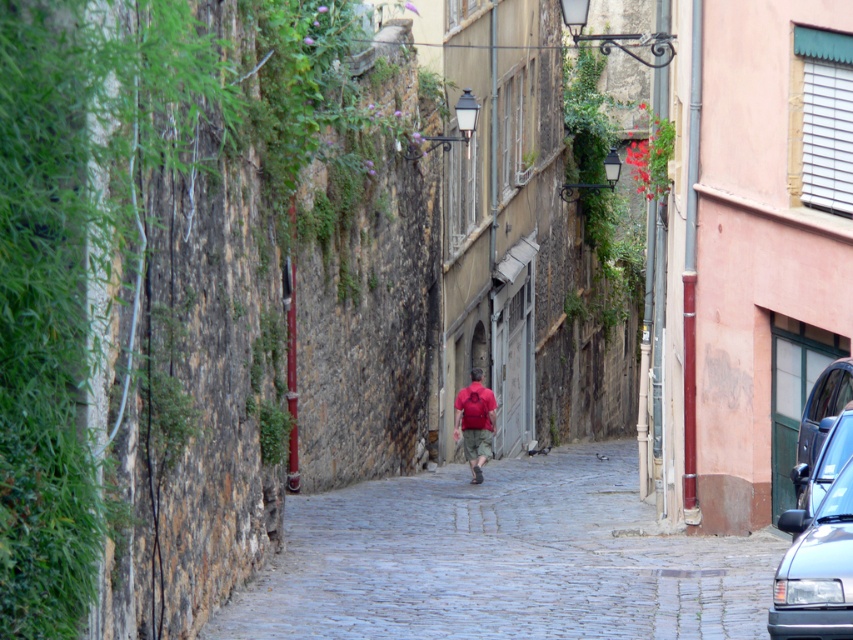
You are a delivery person needing to park a tall delivery van that requires a parking spot with enough vertical clearance. You see the black glossy car at lower right and the metallic silver car at right. Which parking spot between these two cars would allow your van to fit vertically?

The parking spot between the black glossy car at lower right and the metallic silver car at right would allow the van to fit vertically because the black glossy car at lower right has a greater height, indicating there is more vertical space available compared to the metallic silver car at right.

You are standing at the entrance of the narrow cobblestone street and want to walk to the end of the path. Which direction should you head to follow the cobblestone path at center?

The cobblestone path at center is located at point (502,561), so you should head towards the center direction to follow the cobblestone path at center.